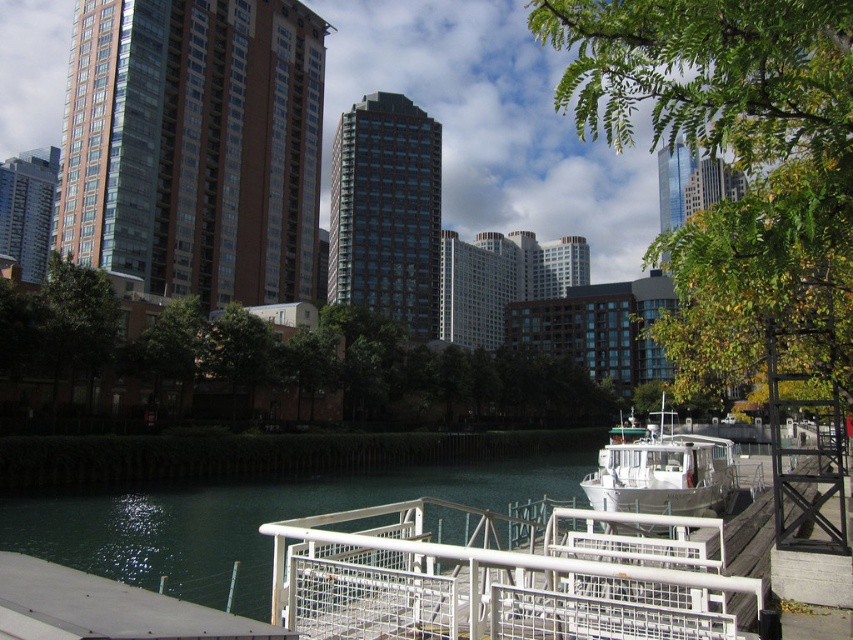
Between white metal railing at lower center and white matte boat at center, which one has less height?

white metal railing at lower center is shorter.

Can you confirm if white metal railing at lower center is smaller than white matte boat at center?

Correct, white metal railing at lower center occupies less space than white matte boat at center.

Which is in front, point (323, 536) or point (717, 436)?

Point (323, 536)

I want to click on white metal railing at lower center, so click(500, 579).

Who is shorter, green leafy tree at upper right or smooth concrete dock at lower left?

Standing shorter between the two is smooth concrete dock at lower left.

Consider the image. Measure the distance between green leafy tree at upper right and smooth concrete dock at lower left.

The distance of green leafy tree at upper right from smooth concrete dock at lower left is 9.60 meters.

Which is behind, point (793, 288) or point (78, 632)?

The point (793, 288) is behind.

Identify the location of green leafy tree at upper right. The image size is (853, 640). (733, 160).

Which is behind, point (773, 204) or point (375, 541)?

Positioned behind is point (375, 541).

What do you see at coordinates (733, 160) in the screenshot?
I see `green leafy tree at upper right` at bounding box center [733, 160].

Is point (769, 88) less distant than point (665, 584)?

Yes, point (769, 88) is in front of point (665, 584).

This screenshot has width=853, height=640. In order to click on green leafy tree at upper right in this screenshot , I will do `click(733, 160)`.